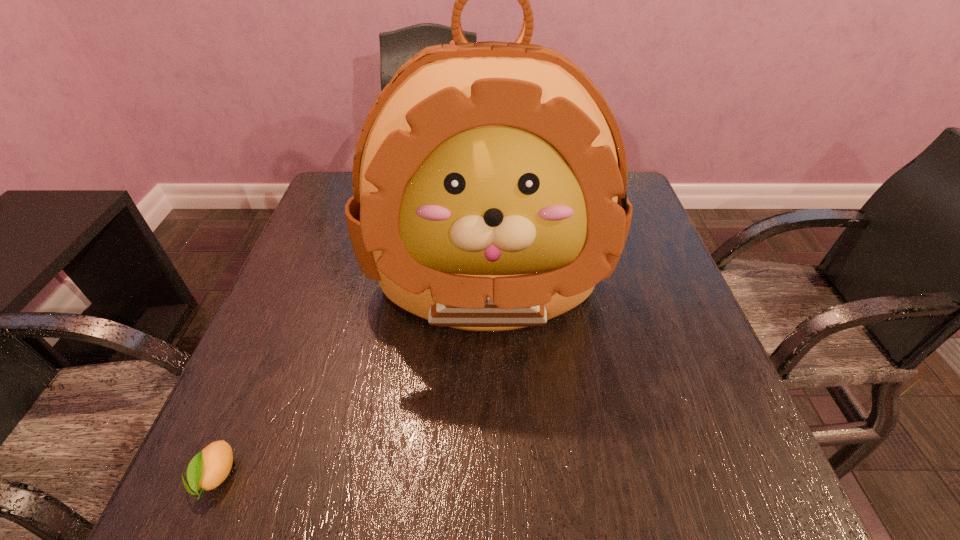
You are a GUI agent. You are given a task and a screenshot of the screen. Output one action in this format:
    pyautogui.click(x=<x>, y=<y>)
    Task: Click on the backpack
    This screenshot has width=960, height=540.
    Given the screenshot: What is the action you would take?
    pyautogui.click(x=489, y=179)

Identify the location of the taller object. This screenshot has width=960, height=540. pos(489,179).

Where is `the left object`? the left object is located at coordinates (210, 467).

You are a GUI agent. You are given a task and a screenshot of the screen. Output one action in this format:
    pyautogui.click(x=<x>, y=<y>)
    Task: Click on the shorter object
    
    Given the screenshot: What is the action you would take?
    pyautogui.click(x=210, y=467)

Find the location of a particular element. The height and width of the screenshot is (540, 960). vacant space located 0.110m on the front-facing side of the taller object is located at coordinates (490, 417).

Locate an element on the screen. object present at the near edge is located at coordinates (210, 467).

Where is `object that is at the left edge`? object that is at the left edge is located at coordinates (210, 467).

I want to click on object that is at the right edge, so click(x=489, y=179).

This screenshot has height=540, width=960. Identify the location of object located at the near left corner. (210, 467).

Where is `vacant space at the left edge`? The width and height of the screenshot is (960, 540). vacant space at the left edge is located at coordinates (291, 332).